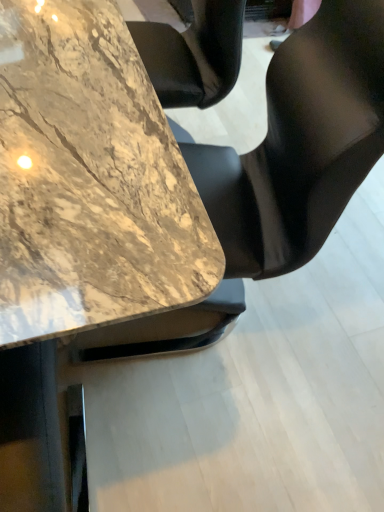
Question: Is marble table at center spatially inside black leather chair at center, or outside of it?

Choices:
 (A) outside
 (B) inside

Answer: (A)

Question: Considering the positions of point (107, 245) and point (339, 14), is point (107, 245) closer or farther from the camera than point (339, 14)?

Choices:
 (A) farther
 (B) closer

Answer: (B)

Question: Is marble table at center wider or thinner than black leather chair at center?

Choices:
 (A) thin
 (B) wide

Answer: (B)

Question: Based on their positions, is black leather chair at center located to the left or right of marble table at center?

Choices:
 (A) right
 (B) left

Answer: (A)

Question: From a real-world perspective, is black leather chair at center physically located above or below marble table at center?

Choices:
 (A) above
 (B) below

Answer: (A)

Question: From the image's perspective, is black leather chair at center located above or below marble table at center?

Choices:
 (A) below
 (B) above

Answer: (A)

Question: Is black leather chair at center spatially inside marble table at center, or outside of it?

Choices:
 (A) outside
 (B) inside

Answer: (A)